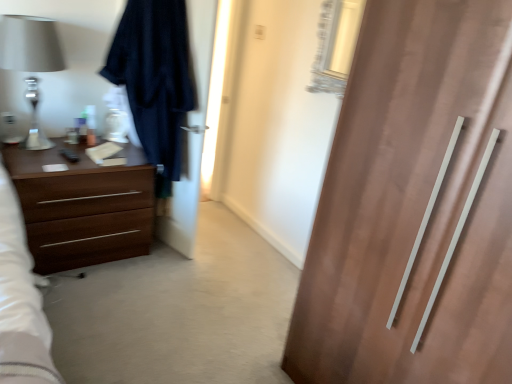
I want to click on matte silver lamp at left, so click(x=30, y=44).

You are a GUI agent. You are given a task and a screenshot of the screen. Output one action in this format:
    pyautogui.click(x=<x>, y=<y>)
    Task: Click on the dark fabric screen door at left
    This screenshot has width=512, height=384.
    Given the screenshot: What is the action you would take?
    pyautogui.click(x=190, y=136)

In the scene shown: Would you consider dark fabric screen door at left to be distant from brown wood chest of drawers at left?

dark fabric screen door at left is actually quite close to brown wood chest of drawers at left.

Is dark fabric screen door at left not inside brown wood chest of drawers at left?

Indeed, dark fabric screen door at left is completely outside brown wood chest of drawers at left.

Is dark fabric screen door at left to the left of brown wood chest of drawers at left from the viewer's perspective?

No, dark fabric screen door at left is not to the left of brown wood chest of drawers at left.

Between dark fabric screen door at left and brown wood chest of drawers at left, which one has smaller size?

Smaller between the two is dark fabric screen door at left.

From the image's perspective, between matte silver lamp at left and dark blue fabric robe at left, who is located below?

dark blue fabric robe at left is shown below in the image.

Measure the distance between matte silver lamp at left and dark blue fabric robe at left.

matte silver lamp at left is 52.53 centimeters away from dark blue fabric robe at left.

Is matte silver lamp at left aimed at dark blue fabric robe at left?

No, matte silver lamp at left is not facing towards dark blue fabric robe at left.

From a real-world perspective, who is located higher, matte silver lamp at left or dark blue fabric robe at left?

From a 3D spatial view, matte silver lamp at left is above.

Does brown wood chest of drawers at left turn towards matte silver lamp at left?

No, brown wood chest of drawers at left is not facing towards matte silver lamp at left.

Which is closer, (34,248) or (44,24)?

Point (34,248) is positioned closer to the camera compared to point (44,24).

Which is correct: brown wood chest of drawers at left is inside matte silver lamp at left, or outside of it?

brown wood chest of drawers at left lies outside matte silver lamp at left.

Which of these two, dark fabric screen door at left or matte silver lamp at left, stands shorter?

matte silver lamp at left.

This screenshot has height=384, width=512. I want to click on table lamp lying in front of the dark fabric screen door at left, so click(x=30, y=44).

Considering the relative sizes of dark fabric screen door at left and matte silver lamp at left in the image provided, is dark fabric screen door at left bigger than matte silver lamp at left?

Yes.

From the image's perspective, who appears lower, dark fabric screen door at left or matte silver lamp at left?

dark fabric screen door at left is shown below in the image.

Which of these two, brown wood chest of drawers at left or dark blue fabric robe at left, is wider?

With larger width is brown wood chest of drawers at left.

From a real-world perspective, is brown wood chest of drawers at left physically above dark blue fabric robe at left?

No, from a real-world perspective, brown wood chest of drawers at left is not on top of dark blue fabric robe at left.

How different are the orientations of brown wood chest of drawers at left and dark blue fabric robe at left in degrees?

brown wood chest of drawers at left and dark blue fabric robe at left are facing 76.9 degrees away from each other.

Identify the location of robe above the brown wood chest of drawers at left (from a real-world perspective). The height and width of the screenshot is (384, 512). (155, 80).

Considering the relative sizes of brown wood chest of drawers at left and dark fabric screen door at left in the image provided, is brown wood chest of drawers at left thinner than dark fabric screen door at left?

No, brown wood chest of drawers at left is not thinner than dark fabric screen door at left.

From the image's perspective, which is below, brown wood chest of drawers at left or dark fabric screen door at left?

From the image's view, brown wood chest of drawers at left is below.

From a real-world perspective, between brown wood chest of drawers at left and dark fabric screen door at left, who is vertically higher?

dark fabric screen door at left.

Considering the positions of objects brown wood chest of drawers at left and dark fabric screen door at left in the image provided, who is more to the right, brown wood chest of drawers at left or dark fabric screen door at left?

Positioned to the right is dark fabric screen door at left.

Considering the sizes of objects dark fabric screen door at left and dark blue fabric robe at left in the image provided, who is thinner, dark fabric screen door at left or dark blue fabric robe at left?

With smaller width is dark fabric screen door at left.

Considering the positions of objects dark fabric screen door at left and dark blue fabric robe at left in the image provided, who is in front, dark fabric screen door at left or dark blue fabric robe at left?

dark blue fabric robe at left is in front.

Is point (198, 188) positioned behind point (108, 72)?

Yes, it is.

I want to click on chest of drawers below the dark fabric screen door at left (from the image's perspective), so click(83, 206).

Image resolution: width=512 pixels, height=384 pixels. I want to click on table lamp lying on the left of dark blue fabric robe at left, so click(30, 44).

From the image, which object appears to be nearer to brown wood chest of drawers at left, dark fabric screen door at left or matte silver lamp at left?

Based on the image, dark fabric screen door at left appears to be nearer to brown wood chest of drawers at left.

Considering their positions, is dark blue fabric robe at left positioned further to dark fabric screen door at left than matte silver lamp at left?

Based on the image, matte silver lamp at left appears to be further to dark fabric screen door at left.

From the image, which object appears to be farther from brown wood chest of drawers at left, dark blue fabric robe at left or matte silver lamp at left?

matte silver lamp at left lies further to brown wood chest of drawers at left than the other object.

From the picture: From the image, which object appears to be farther from dark blue fabric robe at left, dark fabric screen door at left or brown wood chest of drawers at left?

Based on the image, brown wood chest of drawers at left appears to be further to dark blue fabric robe at left.

Considering their positions, is brown wood chest of drawers at left positioned further to matte silver lamp at left than dark fabric screen door at left?

dark fabric screen door at left is further to matte silver lamp at left.

When comparing their distances from dark fabric screen door at left, does brown wood chest of drawers at left or dark blue fabric robe at left seem further?

brown wood chest of drawers at left is positioned further to the anchor dark fabric screen door at left.

Looking at the image, which one is located closer to matte silver lamp at left, dark blue fabric robe at left or dark fabric screen door at left?

dark blue fabric robe at left is positioned closer to the anchor matte silver lamp at left.

Based on their spatial positions, is matte silver lamp at left or brown wood chest of drawers at left further from dark blue fabric robe at left?

matte silver lamp at left is positioned further to the anchor dark blue fabric robe at left.

Find the location of `robe situated between brown wood chest of drawers at left and dark fabric screen door at left from left to right`. robe situated between brown wood chest of drawers at left and dark fabric screen door at left from left to right is located at coordinates (155, 80).

I want to click on screen door between matte silver lamp at left and brown wood chest of drawers at left from top to bottom, so click(190, 136).

Locate an element on the screen. Image resolution: width=512 pixels, height=384 pixels. robe between matte silver lamp at left and brown wood chest of drawers at left in the vertical direction is located at coordinates point(155,80).

Locate an element on the screen. The height and width of the screenshot is (384, 512). robe between matte silver lamp at left and dark fabric screen door at left from left to right is located at coordinates (155, 80).